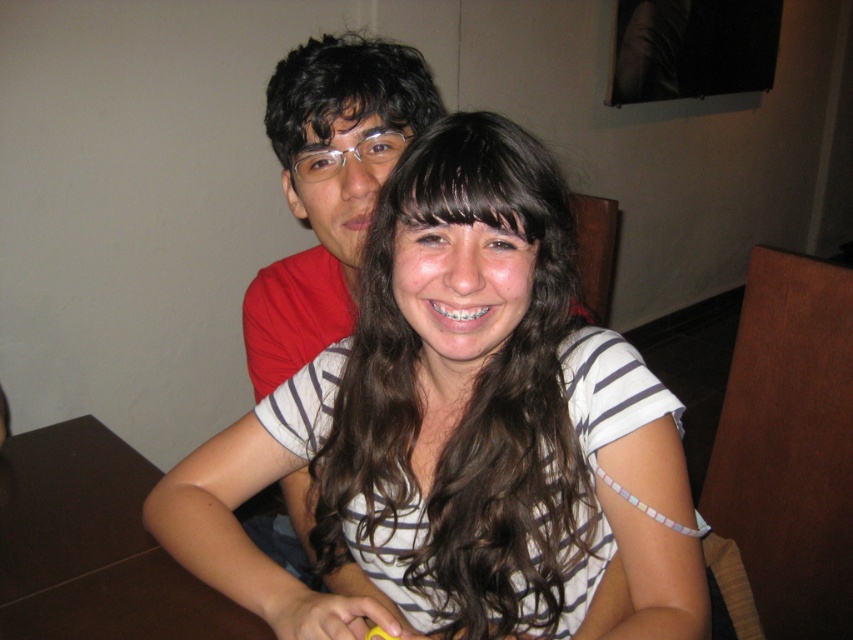
You are a fashion designer observing two shirts displayed on mannequins in a store window. The shirts are the white striped shirt at center and the matte red shirt at center. Which shirt has a wider torso area?

The white striped shirt at center has a wider torso area than the matte red shirt at center, as its width surpasses the latter.